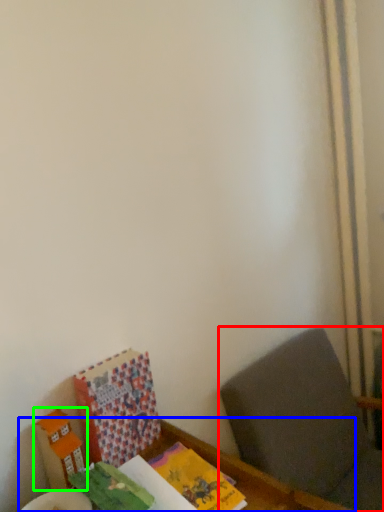
Question: Which is nearer to the furniture (highlighted by a red box)? table (highlighted by a blue box) or cardboard box (highlighted by a green box).

Choices:
 (A) table
 (B) cardboard box

Answer: (A)